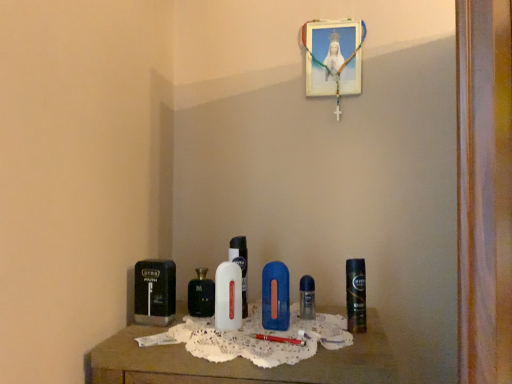
This screenshot has height=384, width=512. What are the coordinates of `vacant area in front of black plastic razor at left, which is the 3th personal care from right to left` in the screenshot? It's located at (155, 337).